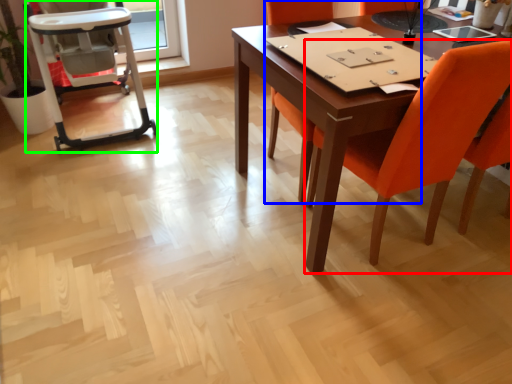
Question: Based on their relative distances, which object is nearer to chair (highlighted by a red box)? Choose from chair (highlighted by a blue box) and armchair (highlighted by a green box).

Choices:
 (A) chair
 (B) armchair

Answer: (A)